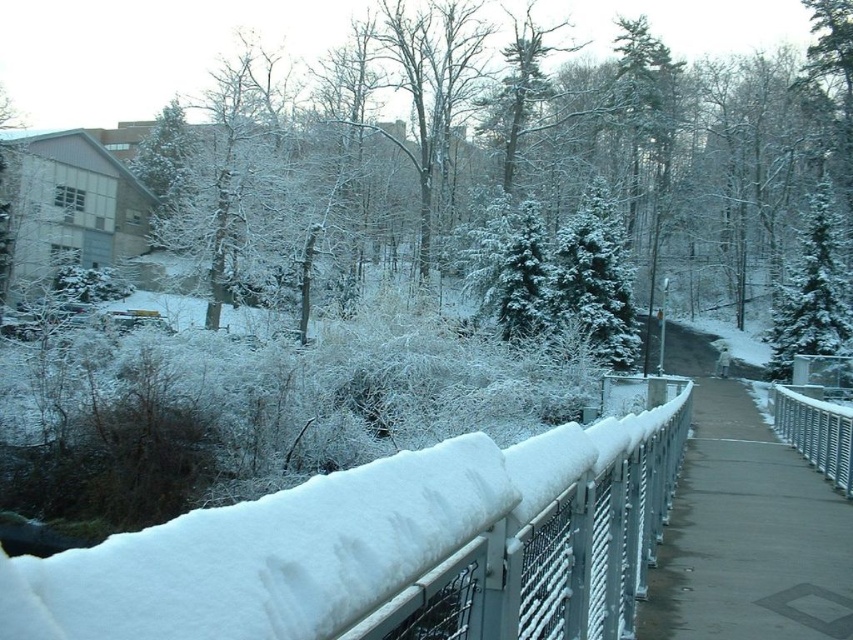
Question: Which point appears farthest from the camera in this image?

Choices:
 (A) (786, 618)
 (B) (846, 330)
 (C) (526, 456)
 (D) (788, 401)

Answer: (B)

Question: Does snow-covered metal fence at center lie in front of gray concrete pavement at center?

Choices:
 (A) yes
 (B) no

Answer: (A)

Question: Which point appears farthest from the camera in this image?

Choices:
 (A) (827, 598)
 (B) (575, 470)
 (C) (833, 346)

Answer: (C)

Question: Is gray concrete pavement at center below silver metallic fence at right?

Choices:
 (A) no
 (B) yes

Answer: (B)

Question: Estimate the real-world distances between objects in this image. Which object is closer to the snow-covered evergreen at upper right?

Choices:
 (A) snow-covered metal fence at center
 (B) gray concrete pavement at center
 (C) silver metallic fence at right

Answer: (C)

Question: Is snow-covered metal fence at center bigger than snow-covered evergreen at upper right?

Choices:
 (A) yes
 (B) no

Answer: (B)